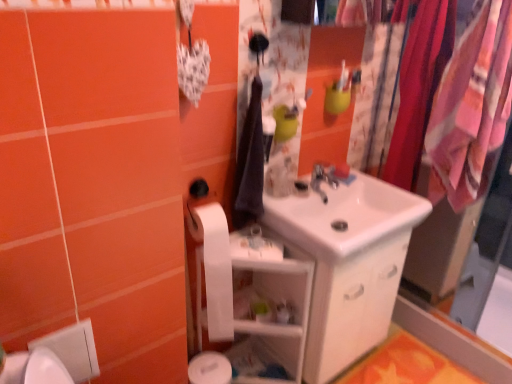
Describe the element at coordinates (215, 268) in the screenshot. The width and height of the screenshot is (512, 384). I see `white matte toilet paper at lower left` at that location.

The width and height of the screenshot is (512, 384). Identify the location of white glossy sink at center. (344, 216).

Locate an element on the screen. The height and width of the screenshot is (384, 512). silky pink fabric at right, the first clothesline viewed from the left is located at coordinates (419, 87).

Where is `pink fabric clothesline at right, positioned as the first clothesline in right-to-left order`? pink fabric clothesline at right, positioned as the first clothesline in right-to-left order is located at coordinates (471, 108).

Describe the element at coordinates (323, 180) in the screenshot. I see `silver metallic faucet at center` at that location.

The image size is (512, 384). Find the location of `white matte toilet paper at lower left`. white matte toilet paper at lower left is located at coordinates (215, 268).

How much distance is there between silky pink fabric at right, which ranks as the second clothesline in right-to-left order, and orange fabric bath mat at lower right?

silky pink fabric at right, which ranks as the second clothesline in right-to-left order, is 1.00 meters from orange fabric bath mat at lower right.

Which object is closer to the camera, silky pink fabric at right, the first clothesline viewed from the left, or orange fabric bath mat at lower right?

silky pink fabric at right, the first clothesline viewed from the left, is closer to the camera.

Is silky pink fabric at right, the first clothesline viewed from the left, not near orange fabric bath mat at lower right?

Yes, silky pink fabric at right, the first clothesline viewed from the left, and orange fabric bath mat at lower right are quite far apart.

Looking at this image, does silver metallic faucet at center have a larger size compared to orange fabric bath mat at lower right?

Incorrect, silver metallic faucet at center is not larger than orange fabric bath mat at lower right.

From a real-world perspective, is silver metallic faucet at center physically below orange fabric bath mat at lower right?

No, from a real-world perspective, silver metallic faucet at center is not below orange fabric bath mat at lower right.

Considering the sizes of objects silver metallic faucet at center and orange fabric bath mat at lower right in the image provided, who is wider, silver metallic faucet at center or orange fabric bath mat at lower right?

orange fabric bath mat at lower right.

In the scene shown: Is silky pink fabric at right, the first clothesline viewed from the left, oriented towards dark blue fabric at center?

No, silky pink fabric at right, the first clothesline viewed from the left, is not facing towards dark blue fabric at center.

Does silky pink fabric at right, which ranks as the second clothesline in right-to-left order, come in front of dark blue fabric at center?

No, it is behind dark blue fabric at center.

Do you think silky pink fabric at right, which ranks as the second clothesline in right-to-left order, is within dark blue fabric at center, or outside of it?

silky pink fabric at right, which ranks as the second clothesline in right-to-left order, lies outside dark blue fabric at center.

At what (x,y) coordinates should I click in order to perform the action: click on shelf that appears in front of the silky pink fabric at right, which ranks as the second clothesline in right-to-left order. Please return your answer as a coordinate pair (x, y). This screenshot has width=512, height=384. Looking at the image, I should click on (276, 303).

In the scene shown: Can you confirm if silky pink fabric at right, the first clothesline viewed from the left, is bigger than white glossy shelf at center?

No.

Does silky pink fabric at right, the first clothesline viewed from the left, touch white glossy shelf at center?

No.

Can you confirm if silky pink fabric at right, the first clothesline viewed from the left, is thinner than white glossy shelf at center?

A: Yes, silky pink fabric at right, the first clothesline viewed from the left, is thinner than white glossy shelf at center.

How far apart are white glossy sink at center and white matte toilet paper at lower left?

white glossy sink at center and white matte toilet paper at lower left are 16.73 inches apart.

Could white matte toilet paper at lower left be considered to be inside white glossy sink at center?

Definitely not — white matte toilet paper at lower left is not inside white glossy sink at center.

Is white glossy sink at center taller than white matte toilet paper at lower left?

No, white glossy sink at center is not taller than white matte toilet paper at lower left.

Which object is positioned more to the right, white glossy sink at center or white matte toilet paper at lower left?

Positioned to the right is white glossy sink at center.

Identify the location of the 1st clothesline in front of the silver metallic faucet at center, counting from the anchor's position. This screenshot has height=384, width=512. (419, 87).

From a real-world perspective, who is located lower, silver metallic faucet at center or silky pink fabric at right, the first clothesline viewed from the left?

silver metallic faucet at center.

Would you say silver metallic faucet at center is inside or outside silky pink fabric at right, which ranks as the second clothesline in right-to-left order?

silver metallic faucet at center is not inside silky pink fabric at right, which ranks as the second clothesline in right-to-left order, it's outside.

What's the angular difference between silver metallic faucet at center and silky pink fabric at right, which ranks as the second clothesline in right-to-left order,'s facing directions?

The angular difference between silver metallic faucet at center and silky pink fabric at right, which ranks as the second clothesline in right-to-left order, is 0.4 degrees.

From a real-world perspective, is white glossy shelf at center physically below dark blue fabric at center?

Indeed, from a real-world perspective, white glossy shelf at center is positioned beneath dark blue fabric at center.

Is dark blue fabric at center inside white glossy shelf at center?

No, white glossy shelf at center does not contain dark blue fabric at center.

Image resolution: width=512 pixels, height=384 pixels. I want to click on clothe on the left of white glossy shelf at center, so click(250, 163).

Is white glossy shelf at center at the right side of dark blue fabric at center?

Indeed, white glossy shelf at center is positioned on the right side of dark blue fabric at center.

This screenshot has width=512, height=384. Identify the location of the 2nd clothesline above the orange fabric bath mat at lower right (from the image's perspective). (419, 87).

Where is `bath mat lying below the silver metallic faucet at center (from the image's perspective)`? This screenshot has height=384, width=512. bath mat lying below the silver metallic faucet at center (from the image's perspective) is located at coordinates pos(405,364).

From the image, which object appears to be farther from silver metallic faucet at center, dark blue fabric at center or white glossy sink at center?

dark blue fabric at center is positioned further to the anchor silver metallic faucet at center.

Based on their spatial positions, is white glossy shelf at center or dark blue fabric at center closer to pink fabric clothesline at right, positioned as the first clothesline in right-to-left order?

The object closer to pink fabric clothesline at right, positioned as the first clothesline in right-to-left order, is dark blue fabric at center.

Consider the image. Looking at the image, which one is located further to white glossy sink at center, silver metallic faucet at center or dark blue fabric at center?

dark blue fabric at center is further to white glossy sink at center.

Based on the photo, when comparing their distances from silver metallic faucet at center, does white glossy shelf at center or white glossy sink at center seem closer?

white glossy sink at center is closer to silver metallic faucet at center.

Which object lies nearer to the anchor point pink fabric clothesline at right, which is the second clothesline from left to right, white matte toilet paper at lower left or orange fabric bath mat at lower right?

orange fabric bath mat at lower right lies closer to pink fabric clothesline at right, which is the second clothesline from left to right, than the other object.

Estimate the real-world distances between objects in this image. Which object is closer to silky pink fabric at right, which ranks as the second clothesline in right-to-left order, white glossy sink at center or silver metallic faucet at center?

white glossy sink at center is positioned closer to the anchor silky pink fabric at right, which ranks as the second clothesline in right-to-left order.

From the image, which object appears to be farther from white glossy sink at center, dark blue fabric at center or white glossy shelf at center?

Based on the image, white glossy shelf at center appears to be further to white glossy sink at center.

Based on their spatial positions, is orange fabric bath mat at lower right or pink fabric clothesline at right, which is the second clothesline from left to right, further from white glossy sink at center?

The object further to white glossy sink at center is orange fabric bath mat at lower right.

The image size is (512, 384). I want to click on tap between dark blue fabric at center and orange fabric bath mat at lower right vertically, so [323, 180].

Locate an element on the screen. Image resolution: width=512 pixels, height=384 pixels. toilet paper between silver metallic faucet at center and white glossy shelf at center vertically is located at coordinates (215, 268).

You are a GUI agent. You are given a task and a screenshot of the screen. Output one action in this format:
    pyautogui.click(x=<x>, y=<y>)
    Task: Click on the tap between pink fabric clothesline at right, which is the second clothesline from left to right, and orange fabric bath mat at lower right vertically
    The height and width of the screenshot is (384, 512).
    Given the screenshot: What is the action you would take?
    pyautogui.click(x=323, y=180)

Where is `sink between silky pink fabric at right, the first clothesline viewed from the left, and orange fabric bath mat at lower right from top to bottom`? The width and height of the screenshot is (512, 384). sink between silky pink fabric at right, the first clothesline viewed from the left, and orange fabric bath mat at lower right from top to bottom is located at coordinates (344, 216).